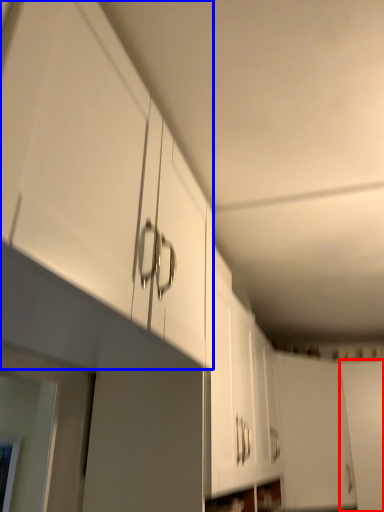
Question: Which object appears farthest to the camera in this image, door (highlighted by a red box) or cabinetry (highlighted by a blue box)?

Choices:
 (A) door
 (B) cabinetry

Answer: (A)